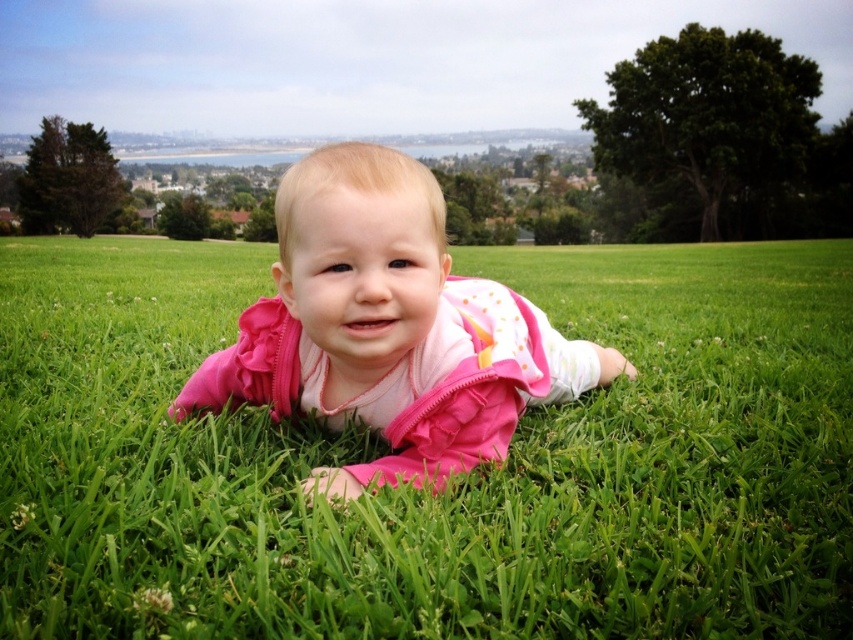
Question: Which point appears closest to the camera in this image?

Choices:
 (A) (161, 310)
 (B) (415, 346)

Answer: (B)

Question: Which point appears closest to the camera in this image?

Choices:
 (A) (280, 284)
 (B) (38, 237)

Answer: (A)

Question: Is pink fabric baby at center thinner than pink fleece baby at center?

Choices:
 (A) yes
 (B) no

Answer: (B)

Question: Is pink fabric baby at center further to camera compared to pink fleece baby at center?

Choices:
 (A) yes
 (B) no

Answer: (B)

Question: Is pink fabric baby at center above pink fleece baby at center?

Choices:
 (A) yes
 (B) no

Answer: (A)